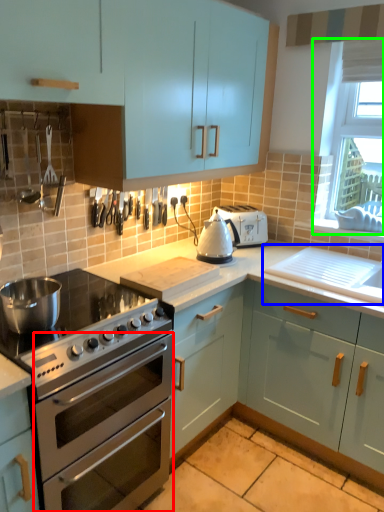
Question: Considering the real-world distances, which object is closest to oven (highlighted by a red box)? sink (highlighted by a blue box) or window screen (highlighted by a green box).

Choices:
 (A) sink
 (B) window screen

Answer: (A)